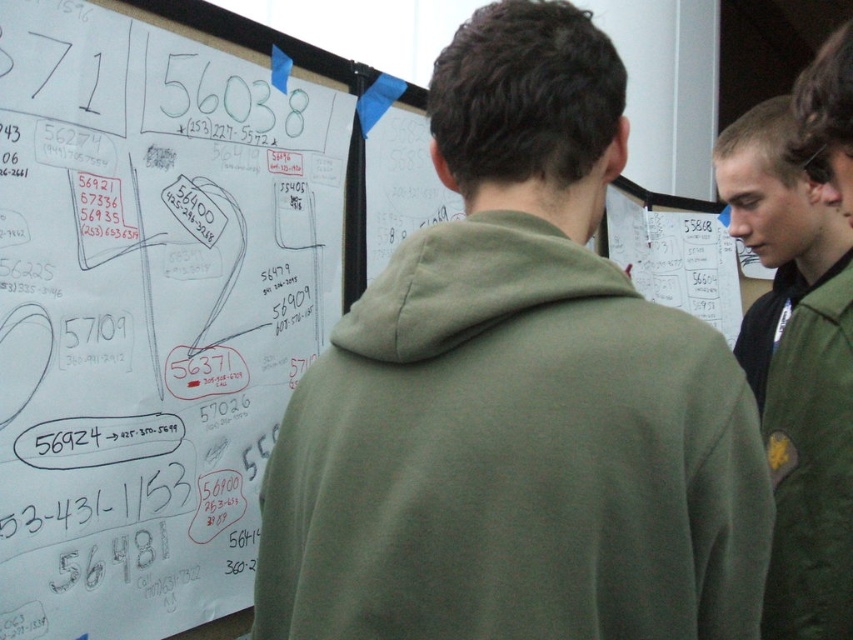
Question: Which object is positioned closest to the green matte jacket at upper right?

Choices:
 (A) green fabric jacket at right
 (B) white paperboard at upper left
 (C) green matte hoodie at center

Answer: (A)

Question: Which of the following is the farthest from the observer?

Choices:
 (A) white paperboard at upper left
 (B) green matte hoodie at center
 (C) green matte jacket at upper right

Answer: (C)

Question: Can you confirm if green matte hoodie at center is wider than green fabric jacket at right?

Choices:
 (A) yes
 (B) no

Answer: (A)

Question: Which point is farther to the camera?

Choices:
 (A) white paperboard at upper left
 (B) green matte hoodie at center

Answer: (A)

Question: Does green matte hoodie at center have a smaller size compared to green fabric jacket at right?

Choices:
 (A) yes
 (B) no

Answer: (B)

Question: Does white paperboard at upper left have a larger size compared to green matte jacket at upper right?

Choices:
 (A) no
 (B) yes

Answer: (B)